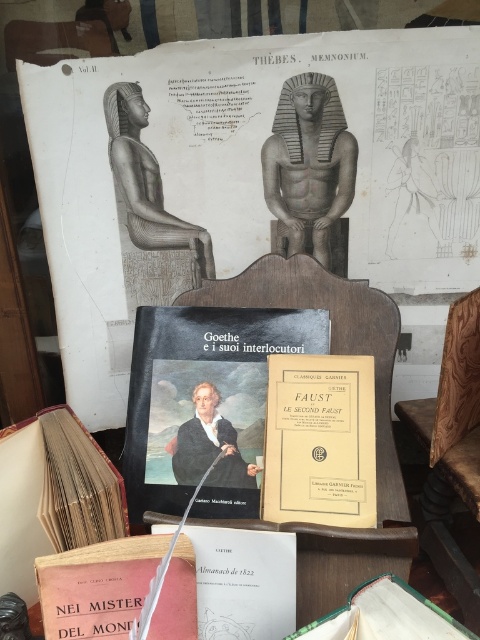
Question: Based on their relative distances, which object is nearer to the matte black book at center?

Choices:
 (A) beige paper book at center
 (B) hardcover book at center
 (C) green leather book at lower center
 (D) matte black statue at upper left

Answer: (A)

Question: Estimate the real-world distances between objects in this image. Which object is closer to the matte black book at center?

Choices:
 (A) gray stone statue at center
 (B) green leather book at lower center

Answer: (A)

Question: Is gray stone statue at center below matte black statue at upper left?

Choices:
 (A) no
 (B) yes

Answer: (A)

Question: Does matte paper poster at upper center have a greater width compared to green leather book at lower center?

Choices:
 (A) yes
 (B) no

Answer: (A)

Question: Is matte black book at center bigger than white paper book at center?

Choices:
 (A) no
 (B) yes

Answer: (B)

Question: Among these objects, which one is farthest from the camera?

Choices:
 (A) matte paper poster at upper center
 (B) matte black statue at upper left
 (C) gray stone statue at center

Answer: (B)